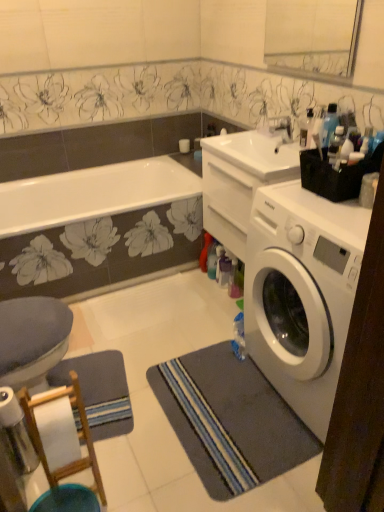
Question: Does white glossy faucet at upper center come behind transparent plastic bottle at upper right, marked as the 2th bottle in a bottom-to-top arrangement?

Choices:
 (A) yes
 (B) no

Answer: (A)

Question: From a real-world perspective, does white glossy faucet at upper center stand above transparent plastic bottle at upper right, marked as the 2th bottle in a bottom-to-top arrangement?

Choices:
 (A) no
 (B) yes

Answer: (A)

Question: Is white glossy faucet at upper center beside transparent plastic bottle at upper right, which is counted as the first bottle, starting from the back?

Choices:
 (A) no
 (B) yes

Answer: (A)

Question: Is white glossy faucet at upper center positioned in front of transparent plastic bottle at upper right, marked as the 2th bottle in a bottom-to-top arrangement?

Choices:
 (A) yes
 (B) no

Answer: (B)

Question: Is white glossy faucet at upper center at the left side of transparent plastic bottle at upper right, the 2th bottle positioned from the front?

Choices:
 (A) yes
 (B) no

Answer: (A)

Question: Is transparent plastic bottle at upper right, the 2th bottle positioned from the front, located within white glossy faucet at upper center?

Choices:
 (A) no
 (B) yes

Answer: (A)

Question: Is white wood bar stool at lower left located within gray striped bath mat at lower right?

Choices:
 (A) no
 (B) yes

Answer: (A)

Question: Is gray striped bath mat at lower right not within white wood bar stool at lower left?

Choices:
 (A) yes
 (B) no

Answer: (A)

Question: Can you confirm if gray striped bath mat at lower right is shorter than white wood bar stool at lower left?

Choices:
 (A) yes
 (B) no

Answer: (A)

Question: Does gray striped bath mat at lower right have a smaller size compared to white wood bar stool at lower left?

Choices:
 (A) no
 (B) yes

Answer: (B)

Question: From a real-world perspective, is gray striped bath mat at lower right over white wood bar stool at lower left?

Choices:
 (A) no
 (B) yes

Answer: (A)

Question: Does gray striped bath mat at lower right have a lesser width compared to white wood bar stool at lower left?

Choices:
 (A) yes
 (B) no

Answer: (B)

Question: Considering the relative sizes of transparent plastic bottle at upper right, which is counted as the first bottle, starting from the back, and white glossy sink at upper center in the image provided, is transparent plastic bottle at upper right, which is counted as the first bottle, starting from the back, taller than white glossy sink at upper center?

Choices:
 (A) no
 (B) yes

Answer: (B)